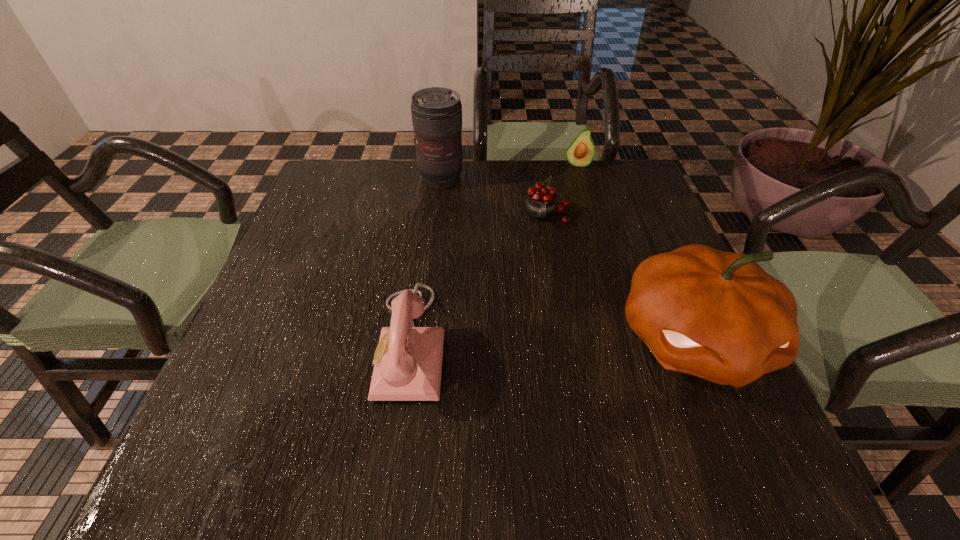
Where is `telephoto lens present at the far edge`? The image size is (960, 540). telephoto lens present at the far edge is located at coordinates (436, 112).

Identify the location of telephone present at the near edge. pyautogui.click(x=408, y=364).

You are a GUI agent. You are given a task and a screenshot of the screen. Output one action in this format:
    pyautogui.click(x=<x>, y=<y>)
    Task: Click on the pumpkin situated at the near edge
    
    Given the screenshot: What is the action you would take?
    pyautogui.click(x=717, y=315)

Image resolution: width=960 pixels, height=540 pixels. I want to click on pumpkin located at the right edge, so click(717, 315).

Find the location of `avocado that is at the right edge`. avocado that is at the right edge is located at coordinates (580, 153).

I want to click on object that is at the far right corner, so click(580, 153).

Identify the location of object situated at the near right corner. (717, 315).

Locate an element on the screen. vacant space at the far edge of the desktop is located at coordinates (583, 185).

Identify the location of free space at the near edge of the desktop. The image size is (960, 540). (584, 415).

Where is `vacant space at the left edge of the desktop`? The image size is (960, 540). vacant space at the left edge of the desktop is located at coordinates (296, 320).